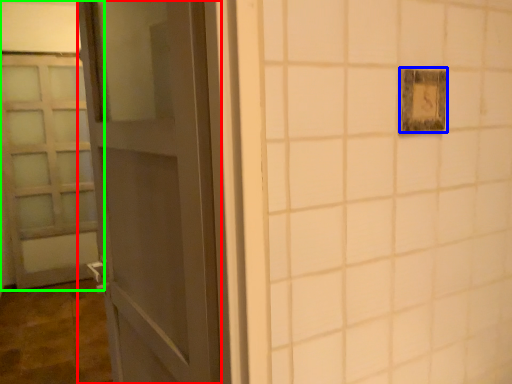
Question: Estimate the real-world distances between objects in this image. Which object is closer to door (highlighted by a red box), light switch (highlighted by a blue box) or door (highlighted by a green box)?

Choices:
 (A) light switch
 (B) door

Answer: (A)